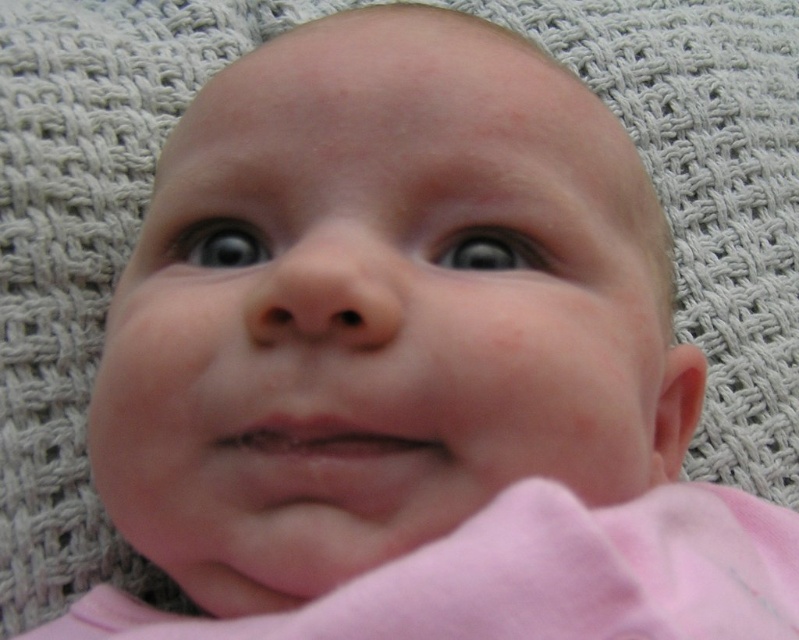
Describe the element at coordinates (489, 250) in the screenshot. I see `blue smooth eye at center` at that location.

Which is behind, point (535, 253) or point (209, 241)?

The point (209, 241) is more distant.

I want to click on blue smooth eye at center, so click(x=489, y=250).